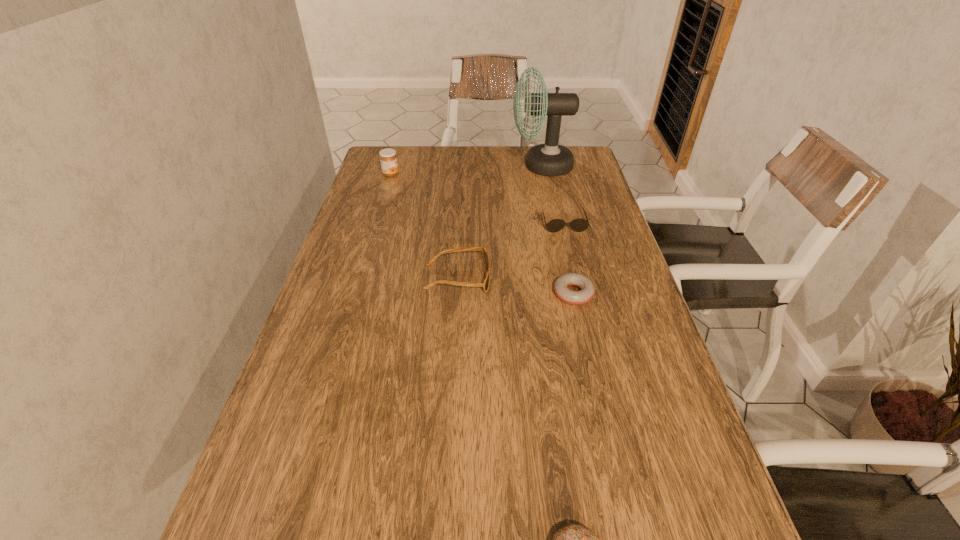
Where is `doughnut that is at the right edge`? The height and width of the screenshot is (540, 960). doughnut that is at the right edge is located at coordinates (561, 285).

Where is `object located in the far left corner section of the desktop`? object located in the far left corner section of the desktop is located at coordinates (388, 159).

At what (x,y) coordinates should I click in order to perform the action: click on object that is at the far right corner. Please return your answer as a coordinate pair (x, y). Looking at the image, I should click on (550, 159).

In the image, there is a desktop. Where is `free region at the far edge`? free region at the far edge is located at coordinates (489, 157).

Image resolution: width=960 pixels, height=540 pixels. What are the coordinates of `vacant space at the left edge of the desktop` in the screenshot? It's located at (401, 225).

At what (x,y) coordinates should I click in order to perform the action: click on free region at the right edge of the desktop. Please return your answer as a coordinate pair (x, y). The image size is (960, 540). Looking at the image, I should click on (586, 182).

Identify the location of free space at the far left corner. (408, 176).

At what (x,y) coordinates should I click in order to perform the action: click on free spot between the right sunglasses and the fifth shortest object. Please return your answer as a coordinate pair (x, y). The height and width of the screenshot is (540, 960). Looking at the image, I should click on (477, 199).

Where is `free space between the farther doughnut and the left sunglasses`? The image size is (960, 540). free space between the farther doughnut and the left sunglasses is located at coordinates (516, 286).

Where is `vacant space that's between the fifth object from right to left and the fifth shortest object`? The width and height of the screenshot is (960, 540). vacant space that's between the fifth object from right to left and the fifth shortest object is located at coordinates (424, 227).